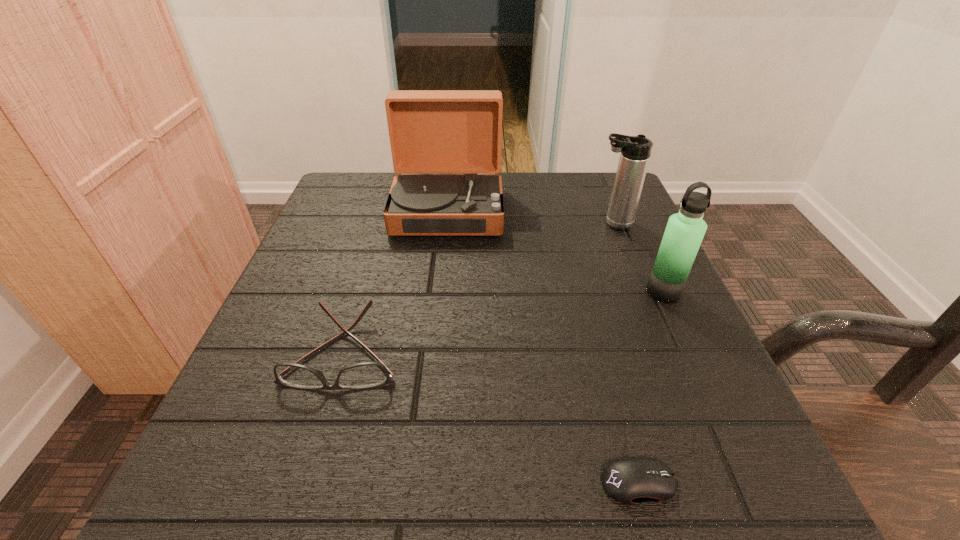
Where is `phonograph record`? phonograph record is located at coordinates (431, 131).

Locate an element on the screen. Image resolution: width=960 pixels, height=540 pixels. the third nearest object is located at coordinates (685, 230).

This screenshot has width=960, height=540. Identify the location of the farther thermos bottle. (635, 151).

At what (x,y) coordinates should I click in order to perform the action: click on the fourth tallest object. Please return your answer as a coordinate pair (x, y). This screenshot has width=960, height=540. Looking at the image, I should click on (363, 375).

You are a GUI agent. You are given a task and a screenshot of the screen. Output one action in this format:
    pyautogui.click(x=<x>, y=<y>)
    Task: Click on the spectacles
    
    Given the screenshot: What is the action you would take?
    pyautogui.click(x=363, y=375)

You are a GUI agent. You are given a task and a screenshot of the screen. Output one action in this format:
    pyautogui.click(x=<x>, y=<y>)
    Task: Click on the shortest object
    
    Given the screenshot: What is the action you would take?
    pyautogui.click(x=633, y=480)

The height and width of the screenshot is (540, 960). In order to click on the third object from left to right in this screenshot , I will do `click(633, 480)`.

The height and width of the screenshot is (540, 960). I want to click on blank space located 0.170m on the face of the phonograph record, so click(439, 296).

Where is `vacant space located 0.400m on the left of the nearer thermos bottle`? Image resolution: width=960 pixels, height=540 pixels. vacant space located 0.400m on the left of the nearer thermos bottle is located at coordinates (424, 292).

You are a GUI agent. You are given a task and a screenshot of the screen. Output one action in this format:
    pyautogui.click(x=<x>, y=<y>)
    Task: Click on the free space located 0.380m on the handle side of the farther thermos bottle
    This screenshot has width=960, height=540.
    Given the screenshot: What is the action you would take?
    pyautogui.click(x=418, y=224)